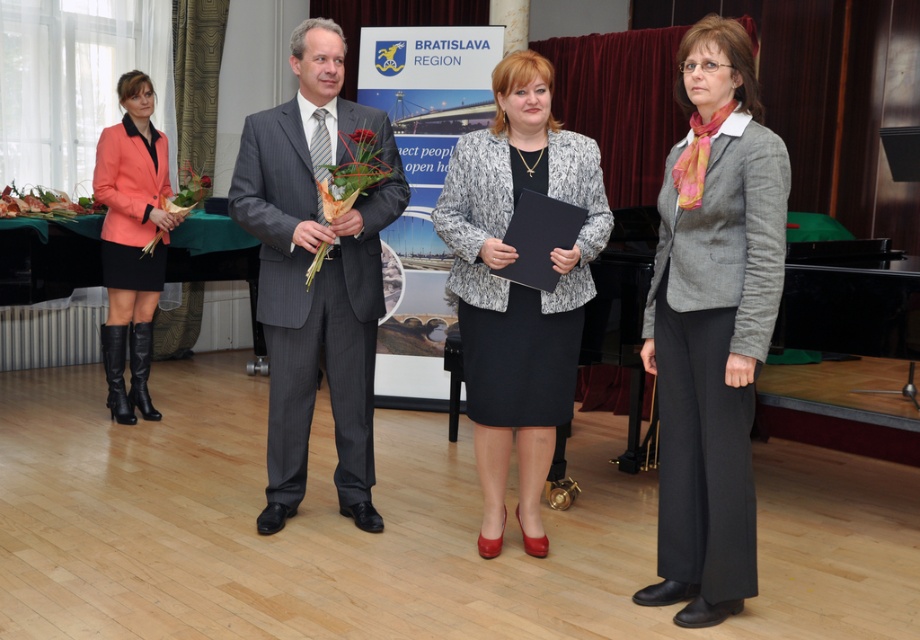
You are a photographer at the event and need to capture a clear shot of both the matte green bouquet at center and the green leafy bouquet at center. Which bouquet should you focus on first to ensure it appears sharp in the photo?

The matte green bouquet at center is below the green leafy bouquet at center, so you should focus on the green leafy bouquet at center first to ensure it stays sharp while the matte green bouquet at center remains in the foreground.

You are a photographer at the event and need to capture a clear photo of the gray woolen blazer at center and the green leafy bouquet at center. Which object might block the view of the other when taking the photo?

The gray woolen blazer at center is in front of the green leafy bouquet at center, so the blazer might block the view of the bouquet.

You are a photographer at the event and need to capture a closeup of both the matte green bouquet at center and the green leafy bouquet at center. Given their sizes, which bouquet will require you to move closer to get a clear shot?

The matte green bouquet at center is smaller in size compared to the green leafy bouquet at center, so you will need to move closer to the matte green bouquet at center to capture a clear closeup.